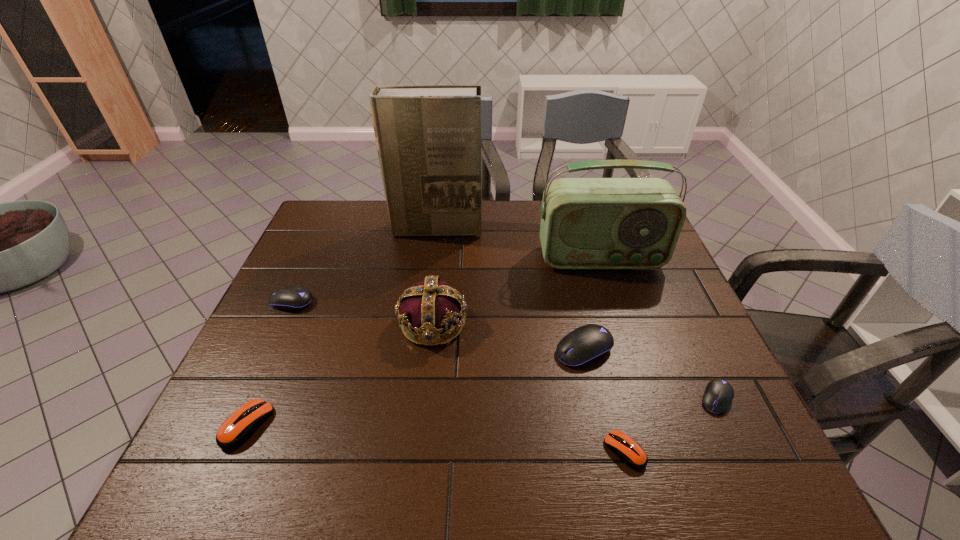
The image size is (960, 540). In order to click on free point at the right edge in this screenshot , I will do `click(623, 275)`.

In order to click on vacant space at the near left corner of the desktop in this screenshot , I will do `click(224, 486)`.

I want to click on vacant area that lies between the tallest computer mouse and the purple crown, so click(508, 336).

The width and height of the screenshot is (960, 540). What are the coordinates of `vacant point located between the radio receiver and the farthest computer mouse` in the screenshot? It's located at (446, 280).

Locate an element on the screen. free point between the nearest black computer mouse and the biggest black computer mouse is located at coordinates (650, 374).

The height and width of the screenshot is (540, 960). I want to click on free area in between the left orange computer mouse and the farthest black computer mouse, so click(270, 363).

This screenshot has width=960, height=540. I want to click on free space between the biggest black computer mouse and the right orange computer mouse, so click(x=604, y=400).

Locate an element on the screen. This screenshot has height=540, width=960. free space that is in between the shortest object and the purple crown is located at coordinates (528, 387).

Find the location of a particular element. This screenshot has height=540, width=960. free space that is in between the left orange computer mouse and the right orange computer mouse is located at coordinates (436, 438).

Identify the location of free space between the purple crown and the second farthest computer mouse. (508, 336).